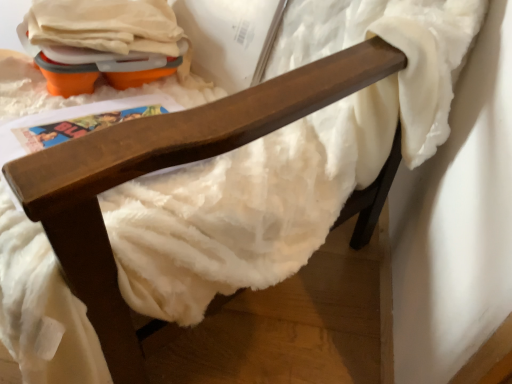
The width and height of the screenshot is (512, 384). Describe the element at coordinates (97, 65) in the screenshot. I see `orange plastic egg carton at upper left` at that location.

Where is `orange plastic egg carton at upper left`? orange plastic egg carton at upper left is located at coordinates (97, 65).

The width and height of the screenshot is (512, 384). What do you see at coordinates (161, 168) in the screenshot?
I see `wooden chair arm at upper center` at bounding box center [161, 168].

Locate an element on the screen. wooden chair arm at upper center is located at coordinates pos(161,168).

This screenshot has height=384, width=512. I want to click on orange plastic egg carton at upper left, so click(97, 65).

Based on their positions, is orange plastic egg carton at upper left located to the left or right of wooden chair arm at upper center?

Based on their positions, orange plastic egg carton at upper left is located to the left of wooden chair arm at upper center.

In the image, is orange plastic egg carton at upper left positioned in front of or behind wooden chair arm at upper center?

orange plastic egg carton at upper left is positioned farther from the viewer than wooden chair arm at upper center.

Is point (56, 72) positioned before point (287, 93)?

No, it is behind (287, 93).

From the image's perspective, is orange plastic egg carton at upper left on top of wooden chair arm at upper center?

Yes, from the image's perspective, orange plastic egg carton at upper left is over wooden chair arm at upper center.

From a real-world perspective, which object rests below the other?

wooden chair arm at upper center, from a real-world perspective.

Based on the photo, is orange plastic egg carton at upper left wider or thinner than wooden chair arm at upper center?

In the image, orange plastic egg carton at upper left appears to be more narrow than wooden chair arm at upper center.

Can you confirm if orange plastic egg carton at upper left is shorter than wooden chair arm at upper center?

Yes, orange plastic egg carton at upper left is shorter than wooden chair arm at upper center.

Who is smaller, orange plastic egg carton at upper left or wooden chair arm at upper center?

With smaller size is orange plastic egg carton at upper left.

Looking at this image, is orange plastic egg carton at upper left inside or outside of wooden chair arm at upper center?

→ orange plastic egg carton at upper left fits inside wooden chair arm at upper center.

Is orange plastic egg carton at upper left not close to wooden chair arm at upper center?

No.

Does orange plastic egg carton at upper left turn towards wooden chair arm at upper center?

Yes, orange plastic egg carton at upper left is facing wooden chair arm at upper center.

How many degrees apart are the facing directions of orange plastic egg carton at upper left and wooden chair arm at upper center?

The angular difference between orange plastic egg carton at upper left and wooden chair arm at upper center is 4.97 degrees.

This screenshot has width=512, height=384. What are the coordinates of `toy above the wooden chair arm at upper center (from the image's perspective)` in the screenshot? It's located at (97, 65).

From the picture: Is wooden chair arm at upper center at the right side of orange plastic egg carton at upper left?

Correct, you'll find wooden chair arm at upper center to the right of orange plastic egg carton at upper left.

Considering the positions of objects wooden chair arm at upper center and orange plastic egg carton at upper left in the image provided, who is in front, wooden chair arm at upper center or orange plastic egg carton at upper left?

wooden chair arm at upper center.

Does point (387, 71) come farther from viewer compared to point (65, 50)?

That is False.

From the image's perspective, is wooden chair arm at upper center positioned above or below orange plastic egg carton at upper left?

wooden chair arm at upper center is below orange plastic egg carton at upper left.

From a real-world perspective, between wooden chair arm at upper center and orange plastic egg carton at upper left, who is vertically lower?

wooden chair arm at upper center is physically lower.

Looking at their sizes, would you say wooden chair arm at upper center is wider or thinner than orange plastic egg carton at upper left?

In the image, wooden chair arm at upper center appears to be wider than orange plastic egg carton at upper left.

Is wooden chair arm at upper center taller or shorter than orange plastic egg carton at upper left?

In the image, wooden chair arm at upper center appears to be taller than orange plastic egg carton at upper left.

Between wooden chair arm at upper center and orange plastic egg carton at upper left, which one has smaller size?

orange plastic egg carton at upper left.

Is wooden chair arm at upper center positioned beyond the bounds of orange plastic egg carton at upper left?

Yes, wooden chair arm at upper center is not within orange plastic egg carton at upper left.

Is wooden chair arm at upper center touching orange plastic egg carton at upper left?

There is a gap between wooden chair arm at upper center and orange plastic egg carton at upper left.

Is wooden chair arm at upper center turned away from orange plastic egg carton at upper left?

Yes, wooden chair arm at upper center's orientation is away from orange plastic egg carton at upper left.

What's the angular difference between wooden chair arm at upper center and orange plastic egg carton at upper left's facing directions?

The angle between the facing direction of wooden chair arm at upper center and the facing direction of orange plastic egg carton at upper left is 4.97 degrees.

How much distance is there between wooden chair arm at upper center and orange plastic egg carton at upper left?

The distance of wooden chair arm at upper center from orange plastic egg carton at upper left is 38.82 centimeters.

This screenshot has width=512, height=384. Find the location of `furniture directly beneath the orange plastic egg carton at upper left (from a real-world perspective)`. furniture directly beneath the orange plastic egg carton at upper left (from a real-world perspective) is located at coordinates (161, 168).

There is a wooden chair arm at upper center. Where is `toy above it (from a real-world perspective)`? This screenshot has width=512, height=384. toy above it (from a real-world perspective) is located at coordinates (97, 65).

This screenshot has width=512, height=384. In order to click on toy above the wooden chair arm at upper center (from the image's perspective) in this screenshot , I will do `click(97, 65)`.